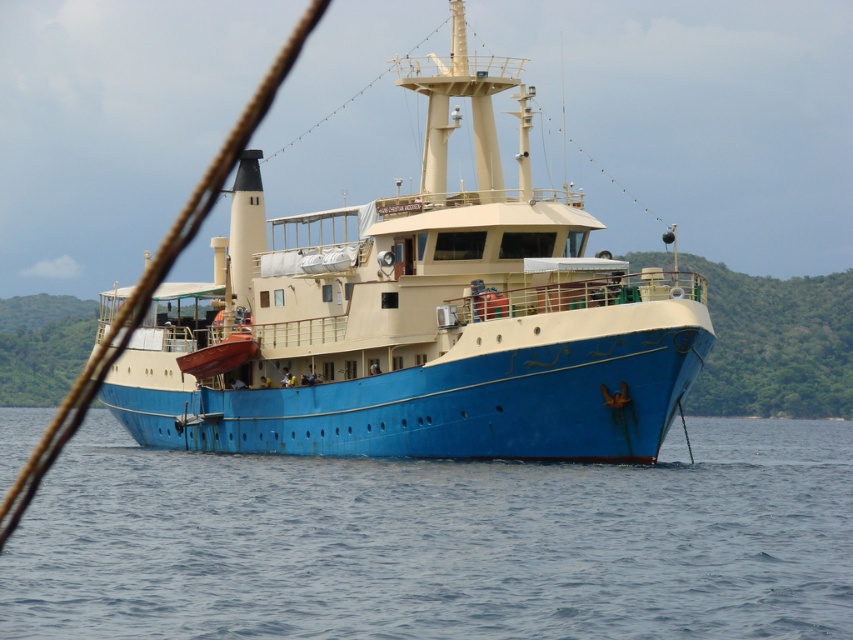
You are standing on the deck of the boat and see two points marked on the ship. The first point is at coordinates point (375, 611) and the second is at point (491, 282). Which point is closer to the front of the boat?

Point (375, 611) is in front of point (491, 282), so it is closer to the front of the boat.

You are standing on the deck of the blue matte boat at center and looking down. Which direction should you look to see the blue matte water at lower center?

The blue matte water at lower center is to the right of the blue matte boat at center, so you should look to your right to see the blue matte water at lower center.